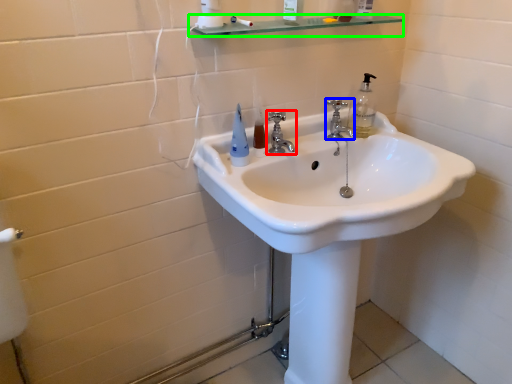
Question: Based on their relative distances, which object is nearer to tap (highlighted by a red box)? Choose from tap (highlighted by a blue box) and balustrade (highlighted by a green box).

Choices:
 (A) tap
 (B) balustrade

Answer: (A)